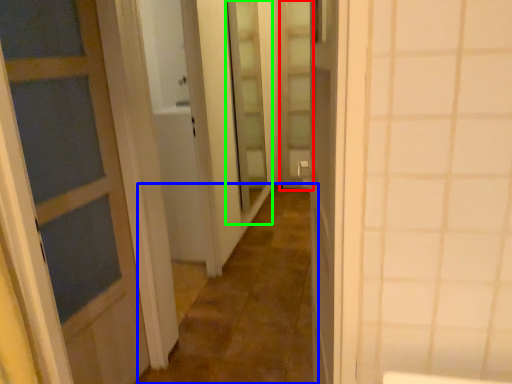
Question: Based on their relative distances, which object is nearer to screen door (highlighted by a red box)? Choose from alley (highlighted by a blue box) and screen door (highlighted by a green box).

Choices:
 (A) alley
 (B) screen door

Answer: (B)